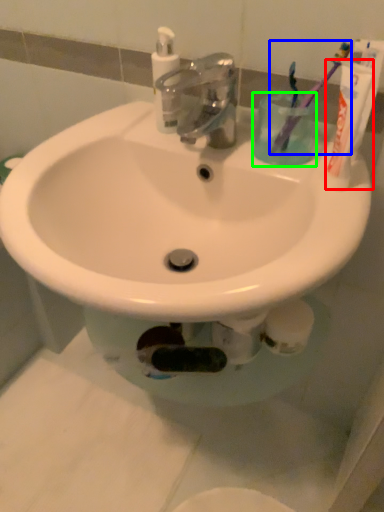
Question: Considering the real-world distances, which object is farthest from toothpaste (highlighted by a red box)? toothbrush (highlighted by a blue box) or liquid (highlighted by a green box)?

Choices:
 (A) toothbrush
 (B) liquid

Answer: (B)